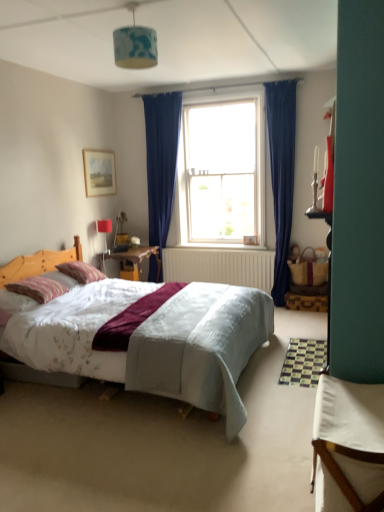
Question: Can you confirm if striped cotton pillow at left, the first pillow when ordered from front to back, is shorter than white glass window at center?

Choices:
 (A) no
 (B) yes

Answer: (B)

Question: From a real-world perspective, is striped cotton pillow at left, marked as the second pillow in a back-to-front arrangement, physically below white glass window at center?

Choices:
 (A) yes
 (B) no

Answer: (A)

Question: Is striped cotton pillow at left, the first pillow when ordered from front to back, smaller than white glass window at center?

Choices:
 (A) no
 (B) yes

Answer: (B)

Question: Is striped cotton pillow at left, the first pillow when ordered from front to back, facing towards white glass window at center?

Choices:
 (A) yes
 (B) no

Answer: (B)

Question: From a real-world perspective, is striped cotton pillow at left, the first pillow when ordered from front to back, physically above white glass window at center?

Choices:
 (A) no
 (B) yes

Answer: (A)

Question: From the image's perspective, is striped cotton pillow at left, marked as the second pillow in a back-to-front arrangement, on top of white glass window at center?

Choices:
 (A) yes
 (B) no

Answer: (B)

Question: Is white fabric table at lower right outside white glass window at center?

Choices:
 (A) no
 (B) yes

Answer: (B)

Question: Can you confirm if white fabric table at lower right is bigger than white glass window at center?

Choices:
 (A) no
 (B) yes

Answer: (A)

Question: From the image's perspective, is white fabric table at lower right under white glass window at center?

Choices:
 (A) yes
 (B) no

Answer: (A)

Question: Does white fabric table at lower right have a lesser height compared to white glass window at center?

Choices:
 (A) no
 (B) yes

Answer: (B)

Question: Is white fabric table at lower right positioned in front of white glass window at center?

Choices:
 (A) yes
 (B) no

Answer: (A)

Question: Does white fabric table at lower right have a lesser width compared to white glass window at center?

Choices:
 (A) no
 (B) yes

Answer: (A)

Question: Considering the relative sizes of wooden picture frame at upper left and blue fabric lampshade at upper center in the image provided, is wooden picture frame at upper left wider than blue fabric lampshade at upper center?

Choices:
 (A) no
 (B) yes

Answer: (A)